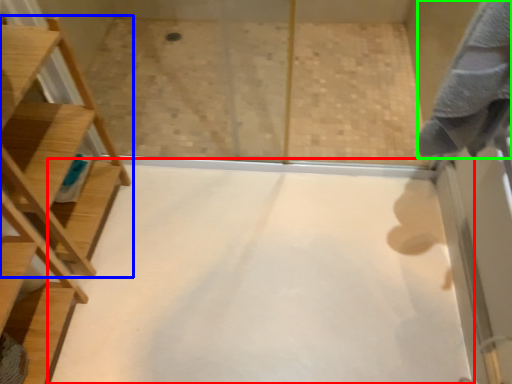
Question: Which is farther away from plain (highlighted by a red box)? furniture (highlighted by a blue box) or bath towel (highlighted by a green box)?

Choices:
 (A) furniture
 (B) bath towel

Answer: (B)